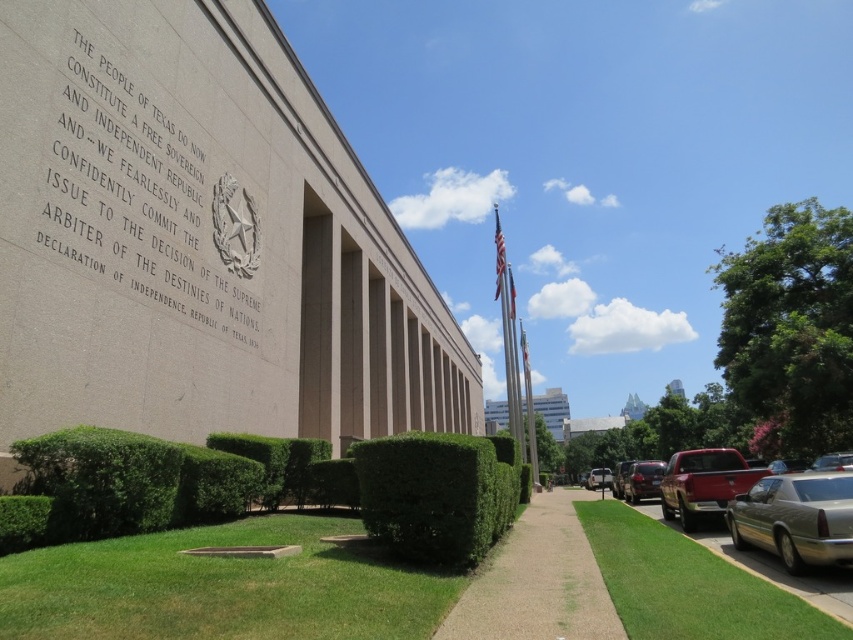
Between black stone engraving at upper left and green grass at lower center, which one has less height?

green grass at lower center is shorter.

Measure the distance between black stone engraving at upper left and green grass at lower center.

black stone engraving at upper left and green grass at lower center are 7.01 meters apart.

Who is more distant from viewer, [112,205] or [165,589]?

The point [112,205] is behind.

At what (x,y) coordinates should I click in order to perform the action: click on black stone engraving at upper left. Please return your answer as a coordinate pair (x, y). The image size is (853, 640). Looking at the image, I should click on (148, 186).

Who is shorter, light gray concrete sidewalk at center or metallic silver sedan at center?

light gray concrete sidewalk at center is shorter.

Does light gray concrete sidewalk at center have a lesser width compared to metallic silver sedan at center?

Correct, light gray concrete sidewalk at center's width is less than metallic silver sedan at center's.

Who is more distant from viewer, (x=491, y=637) or (x=608, y=474)?

Point (x=608, y=474)

This screenshot has height=640, width=853. What are the coordinates of `light gray concrete sidewalk at center` in the screenshot? It's located at (537, 580).

Locate an element on the screen. Image resolution: width=853 pixels, height=640 pixels. green grass at lower center is located at coordinates (221, 588).

From the picture: Does green grass at lower center have a lesser height compared to green leafy hedge at center?

Correct, green grass at lower center is not as tall as green leafy hedge at center.

Locate an element on the screen. This screenshot has width=853, height=640. green grass at lower center is located at coordinates (221, 588).